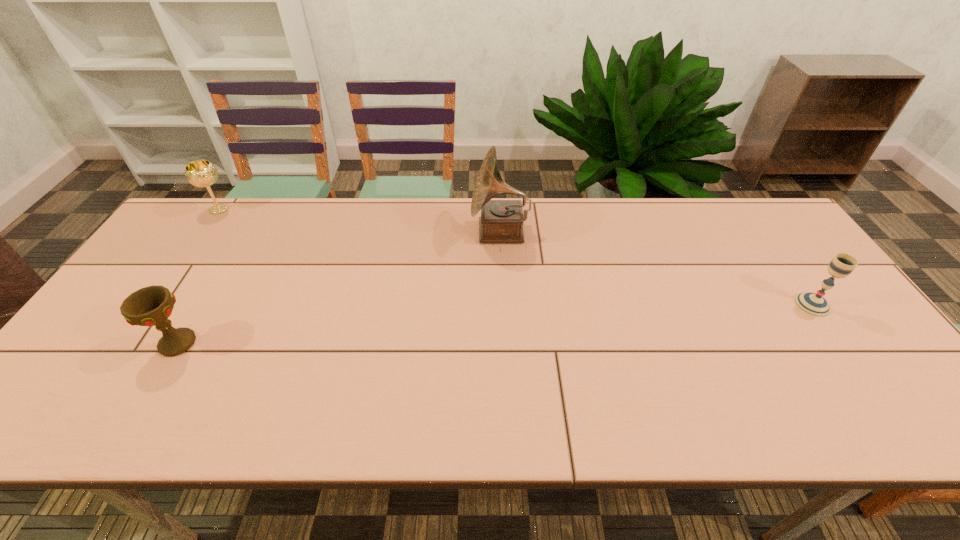
The image size is (960, 540). I want to click on the tallest object, so click(x=501, y=221).

You are a GUI agent. You are given a task and a screenshot of the screen. Output one action in this format:
    pyautogui.click(x=<x>, y=<y>)
    Task: Click on the second object from right to left
    
    Given the screenshot: What is the action you would take?
    pyautogui.click(x=501, y=221)

At what (x,y) coordinates should I click in order to perform the action: click on the farthest chalice. Please return your answer as a coordinate pair (x, y). The width and height of the screenshot is (960, 540). Looking at the image, I should click on (201, 173).

You are a GUI agent. You are given a task and a screenshot of the screen. Output one action in this format:
    pyautogui.click(x=<x>, y=<y>)
    Task: Click on the leftmost chalice
    
    Given the screenshot: What is the action you would take?
    pyautogui.click(x=201, y=173)

Identify the location of the rightmost object. (813, 304).

You are a GUI agent. You are given a task and a screenshot of the screen. Output one action in this format:
    pyautogui.click(x=<x>, y=<y>)
    Task: Click on the second farthest chalice
    
    Given the screenshot: What is the action you would take?
    pyautogui.click(x=813, y=304)

In order to click on the nearest chalice in this screenshot , I will do [x=150, y=306].

I want to click on the second chalice from left to right, so click(x=150, y=306).

Where is `vacant area situated 0.050m on the horn of the phonograph record`? This screenshot has width=960, height=540. vacant area situated 0.050m on the horn of the phonograph record is located at coordinates (455, 232).

The width and height of the screenshot is (960, 540). I want to click on free space located 0.360m on the horn of the phonograph record, so click(355, 232).